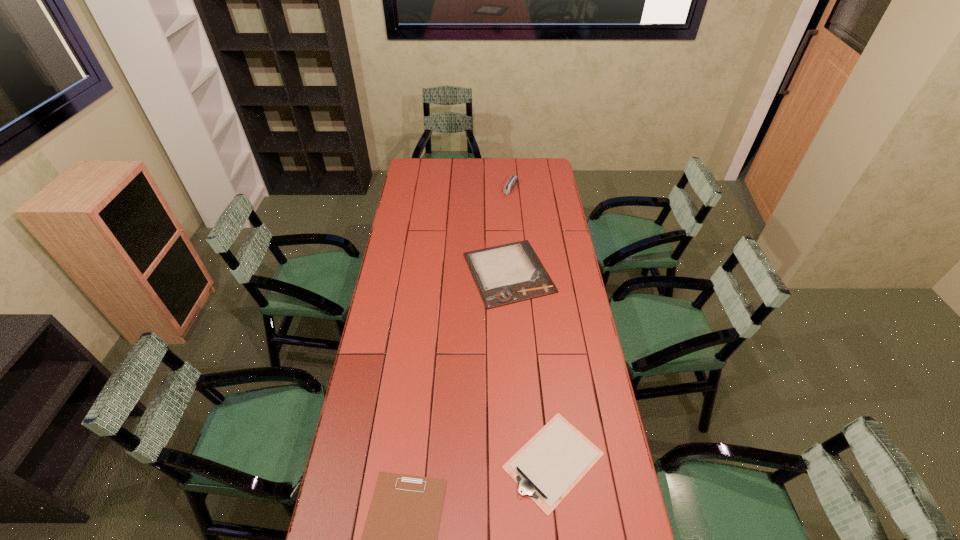
Identify the location of the farthest object. point(512,181).

Where is `pencil box`? This screenshot has width=960, height=540. pencil box is located at coordinates (512, 181).

This screenshot has height=540, width=960. I want to click on the second farthest object, so click(509, 273).

The width and height of the screenshot is (960, 540). I want to click on the third shortest object, so click(x=509, y=273).

Locate an element on the screen. Image resolution: width=960 pixels, height=540 pixels. the second tallest clipboard is located at coordinates (553, 461).

I want to click on free point located 0.070m on the front of the farthest object, so click(512, 205).

The height and width of the screenshot is (540, 960). Identify the location of vacant position located on the back of the tallest clipboard. (505, 220).

In order to click on free space located 0.370m on the left of the second shortest object in this screenshot , I will do `click(386, 461)`.

Where is `free location at the far edge`? The image size is (960, 540). free location at the far edge is located at coordinates (469, 170).

In the image, there is a desktop. Identify the location of vacant space at the left edge. This screenshot has height=540, width=960. (413, 279).